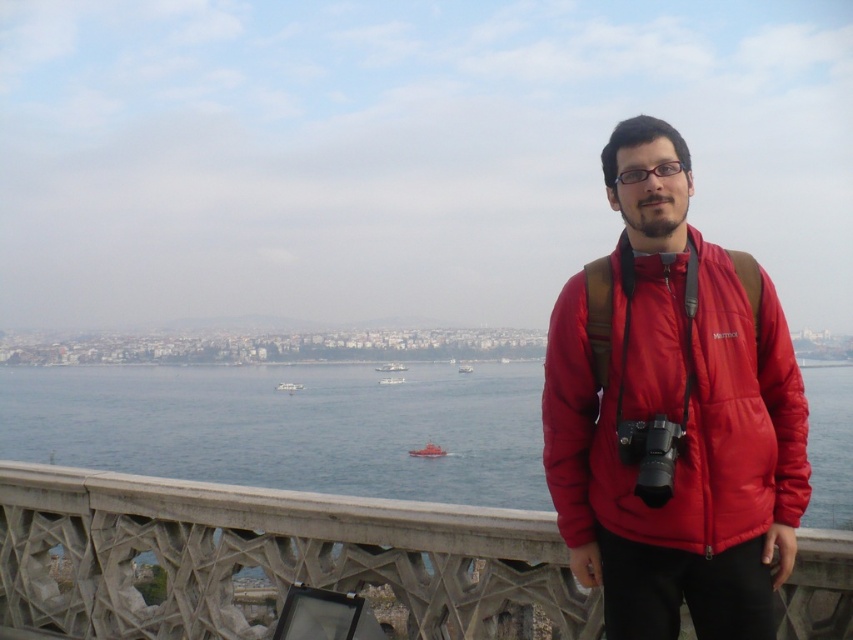
Question: Which object is farther from the camera taking this photo?

Choices:
 (A) smooth red boat at center
 (B) metallic silver boat at center
 (C) smooth white boat at center

Answer: (A)

Question: Does matte red jacket at right appear under concrete textured rail at lower center?

Choices:
 (A) yes
 (B) no

Answer: (B)

Question: Does blue water at center come in front of metallic silver boat at center?

Choices:
 (A) yes
 (B) no

Answer: (A)

Question: Among these points, which one is nearest to the camera?

Choices:
 (A) (787, 486)
 (B) (403, 365)
 (C) (28, 369)
 (D) (642, 172)

Answer: (A)

Question: Is metallic silver boat at center to the right of white plastic boat at center from the viewer's perspective?

Choices:
 (A) no
 (B) yes

Answer: (A)

Question: Which point appears closest to the camera in this image?

Choices:
 (A) (471, 371)
 (B) (637, 168)
 (C) (733, 515)

Answer: (C)